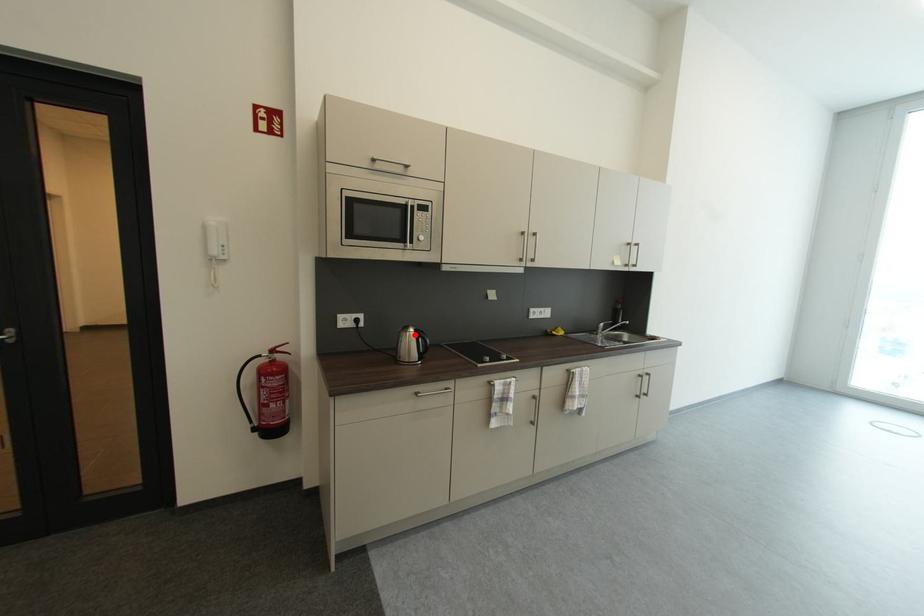
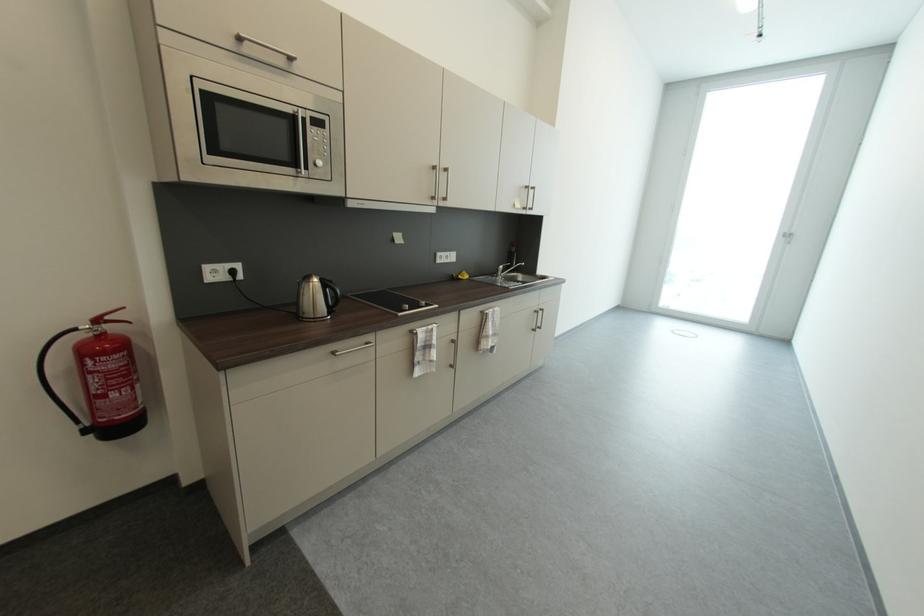
Locate, in the second image, the point that corresponds to the highlighted location in the first image.

(317, 285)